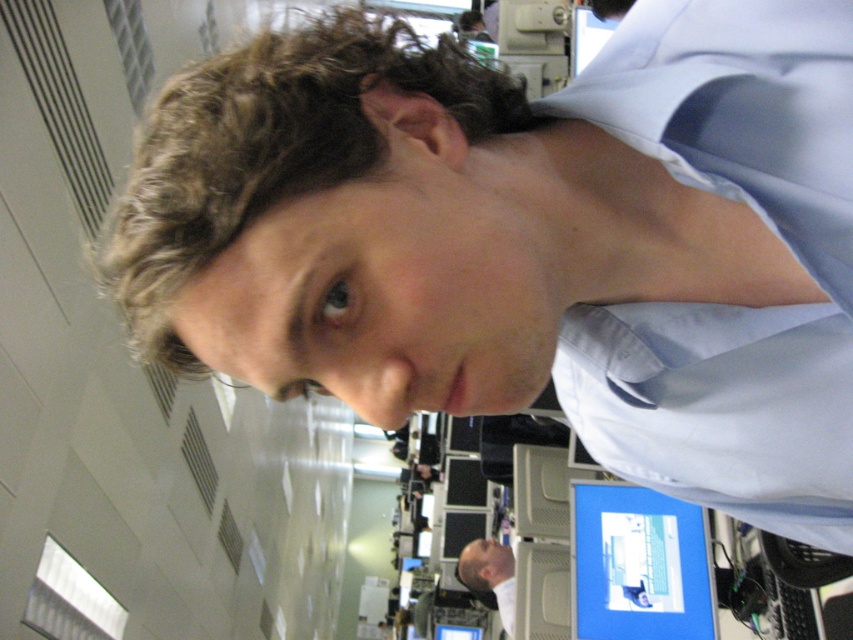
Describe the element at coordinates (727, 304) in the screenshot. The width and height of the screenshot is (853, 640). I see `light blue satin dress shirt at upper right` at that location.

Does point (782, 488) come closer to viewer compared to point (512, 621)?

Yes.

Find the location of a particular element. This screenshot has height=640, width=853. light blue satin dress shirt at upper right is located at coordinates tap(727, 304).

Does blue glossy monitor at lower right have a larger size compared to smooth bald head at lower center?

No, blue glossy monitor at lower right is not bigger than smooth bald head at lower center.

Does point (635, 518) come in front of point (486, 579)?

Yes.

You are a GUI agent. You are given a task and a screenshot of the screen. Output one action in this format:
    pyautogui.click(x=<x>, y=<y>)
    Task: Click on the blue glossy monitor at lower right
    
    Given the screenshot: What is the action you would take?
    pyautogui.click(x=637, y=564)

Can you confirm if light blue satin dress shirt at upper right is positioned to the right of blue glossy monitor at lower right?

Incorrect, light blue satin dress shirt at upper right is not on the right side of blue glossy monitor at lower right.

Is light blue satin dress shirt at upper right wider than blue glossy monitor at lower right?

No.

Is point (848, 288) closer to camera compared to point (585, 513)?

Yes, point (848, 288) is in front of point (585, 513).

This screenshot has height=640, width=853. In order to click on light blue satin dress shirt at upper right in this screenshot , I will do `click(727, 304)`.